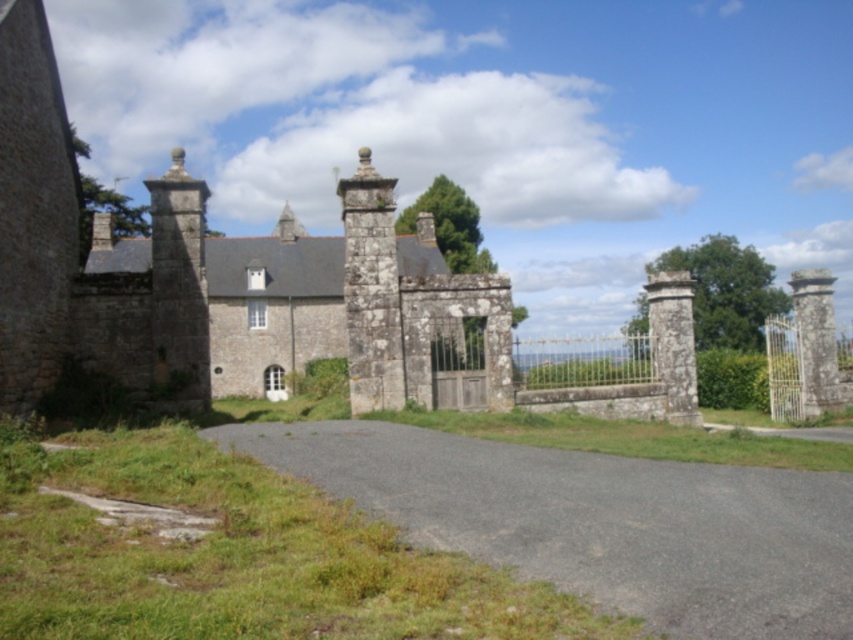
Question: Considering the real-world distances, which object is farthest from the gray asphalt driveway at center?

Choices:
 (A) gray stone pillar at right
 (B) wooden gate at center
 (C) gray stone pillar at center
 (D) stone column at right

Answer: (A)

Question: Which point is closer to the camera?

Choices:
 (A) wooden gate at center
 (B) gray stone pillar at center
 (C) stone column at right
 (D) gray stone pillar at right

Answer: (B)

Question: Is gray asphalt driveway at center positioned in front of stone column at right?

Choices:
 (A) yes
 (B) no

Answer: (A)

Question: Which object appears closest to the camera in this image?

Choices:
 (A) stone column at right
 (B) gray stone pillar at right

Answer: (A)

Question: Can you confirm if gray asphalt driveway at center is positioned above stone column at right?

Choices:
 (A) no
 (B) yes

Answer: (A)

Question: Does gray asphalt driveway at center appear under gray stone pillar at right?

Choices:
 (A) no
 (B) yes

Answer: (B)